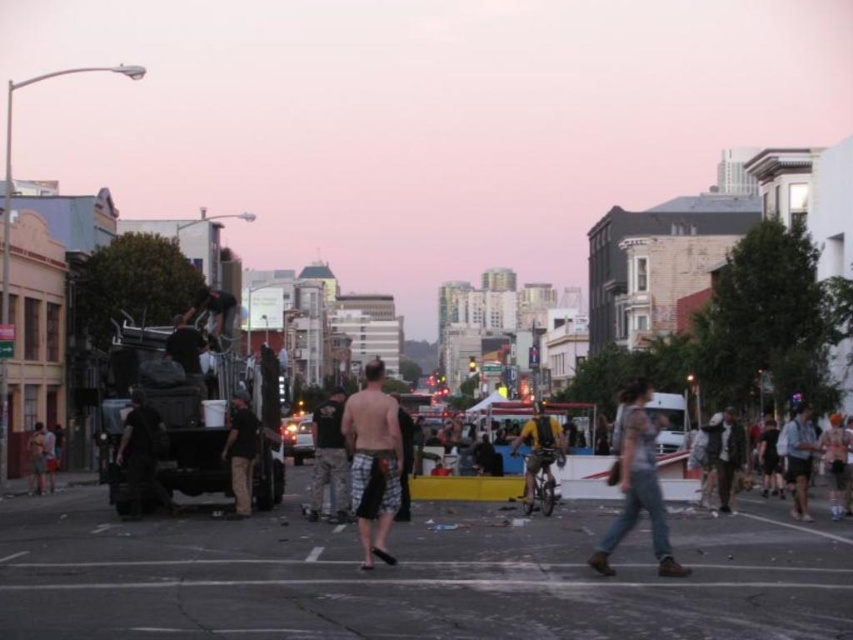
Question: Which of the following is the farthest from the observer?

Choices:
 (A) (645, 472)
 (B) (369, 410)

Answer: (B)

Question: Can you confirm if denim shorts at center is bigger than yellow-green fabric backpack at center-right?

Choices:
 (A) no
 (B) yes

Answer: (B)

Question: Which of the following is the closest to the observer?

Choices:
 (A) denim shorts at center
 (B) plaid shorts at center
 (C) camouflage pants at center

Answer: (A)

Question: Is camouflage pants at center above yellow-green fabric backpack at center-right?

Choices:
 (A) yes
 (B) no

Answer: (B)

Question: Is plaid shorts at center positioned before yellow-green fabric backpack at center-right?

Choices:
 (A) no
 (B) yes

Answer: (B)

Question: Which point is farther from the camera taking this photo?

Choices:
 (A) (368, 419)
 (B) (634, 460)
 (C) (314, 428)

Answer: (C)